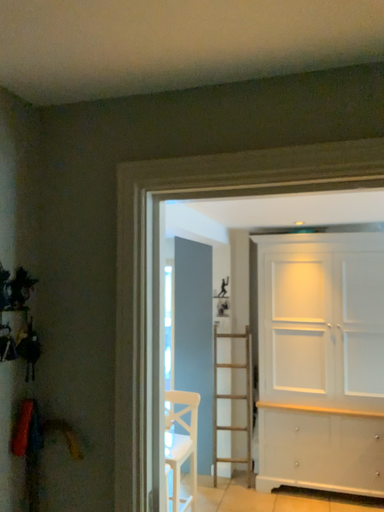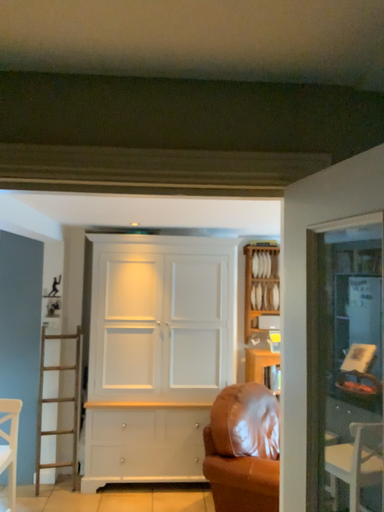
Question: How did the camera likely rotate when shooting the video?

Choices:
 (A) rotated left
 (B) rotated right

Answer: (B)